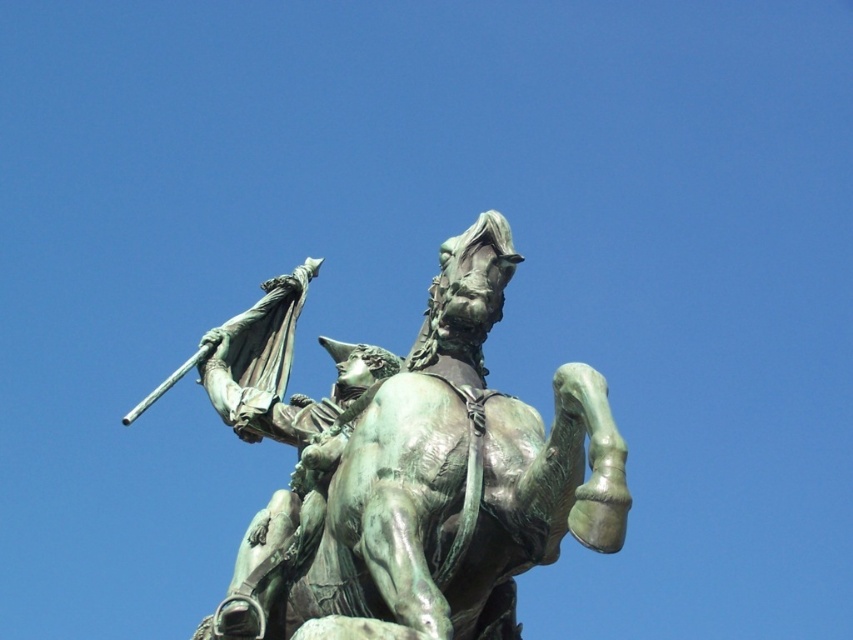
Question: Does green patina bronze horse and rider at center have a lesser width compared to green patina statue at upper center?

Choices:
 (A) no
 (B) yes

Answer: (A)

Question: Is green patina bronze horse and rider at center positioned at the back of green patina statue at upper center?

Choices:
 (A) no
 (B) yes

Answer: (A)

Question: Does green patina bronze horse and rider at center lie behind green patina statue at upper center?

Choices:
 (A) no
 (B) yes

Answer: (A)

Question: Which object is closer to the camera taking this photo?

Choices:
 (A) green patina statue at upper center
 (B) green patina bronze horse and rider at center

Answer: (B)